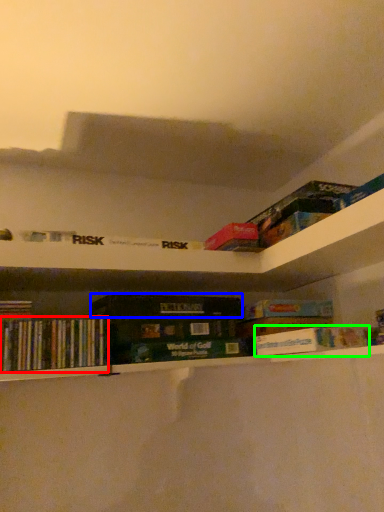
Question: Based on their relative distances, which object is nearer to book (highlighted by a red box)? Choose from paperback book (highlighted by a blue box) and book (highlighted by a green box).

Choices:
 (A) paperback book
 (B) book

Answer: (A)